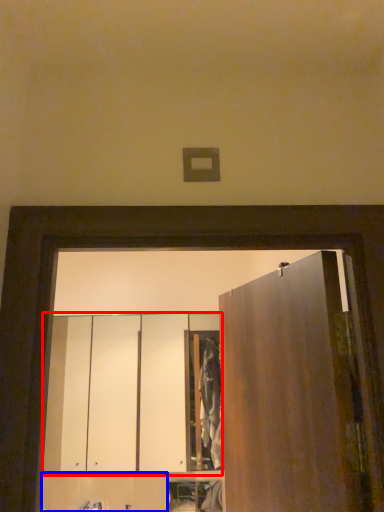
Question: Which object appears closest to the camera in this image, cabinetry (highlighted by a red box) or cabinetry (highlighted by a blue box)?

Choices:
 (A) cabinetry
 (B) cabinetry

Answer: (B)